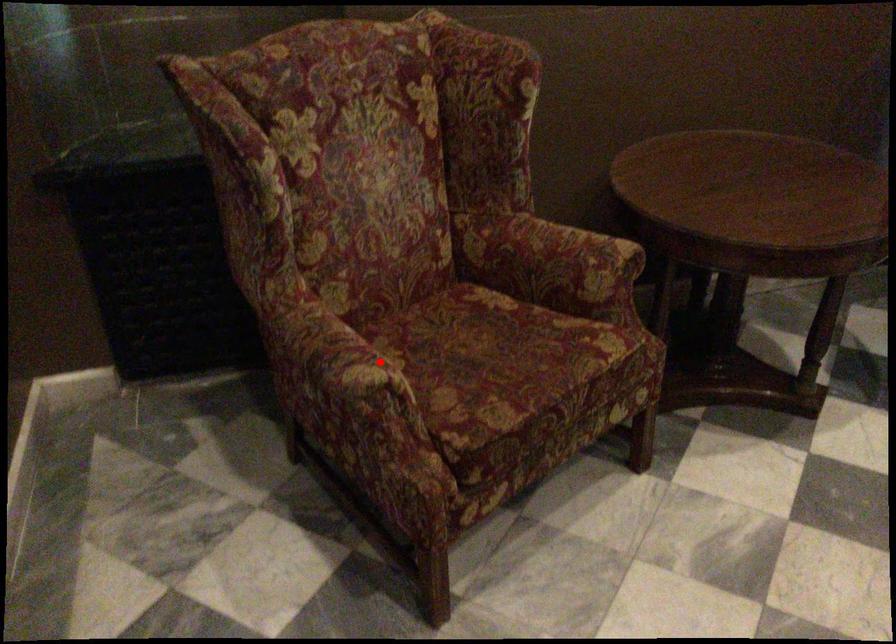
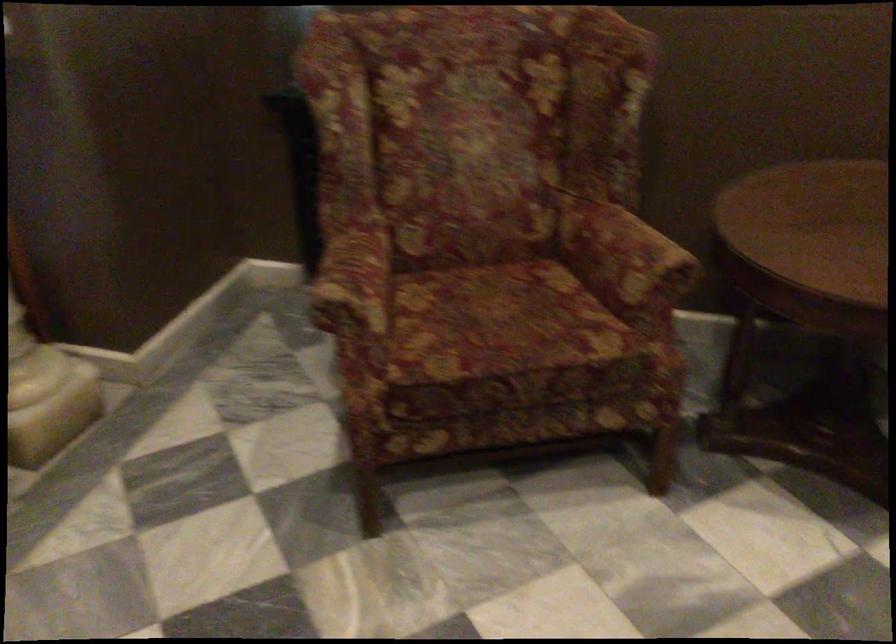
Question: I am providing you with two images of the same scene from different viewpoints. Given a red point in image1, look at the same physical point in image2. Is it:

Choices:
 (A) Closer to the viewpoint
 (B) Farther from the viewpoint

Answer: (B)